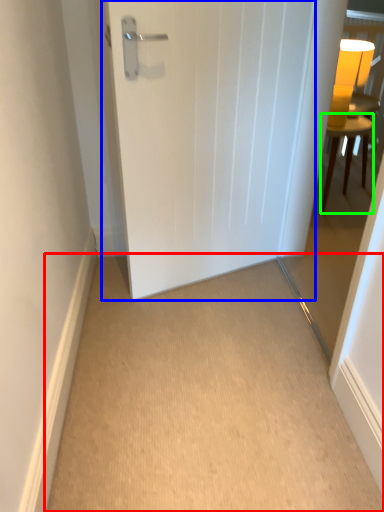
Question: Estimate the real-world distances between objects in this image. Which object is closer to corridor (highlighted by a red box), door (highlighted by a blue box) or furniture (highlighted by a green box)?

Choices:
 (A) door
 (B) furniture

Answer: (A)